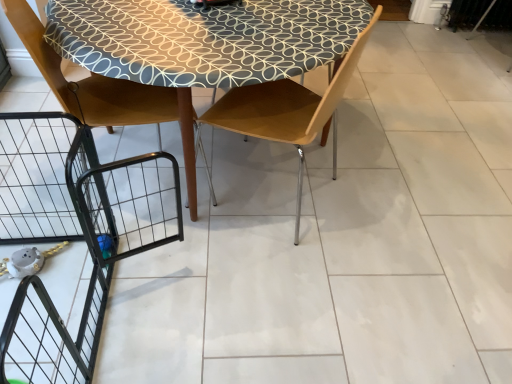
You are a GUI agent. You are given a task and a screenshot of the screen. Output one action in this format:
    pyautogui.click(x=<x>, y=<y>)
    Task: Click on the free space in front of wooden chair at center, which is counted as the 1th chair, starting from the right
    This screenshot has width=512, height=384.
    Given the screenshot: What is the action you would take?
    pyautogui.click(x=267, y=265)